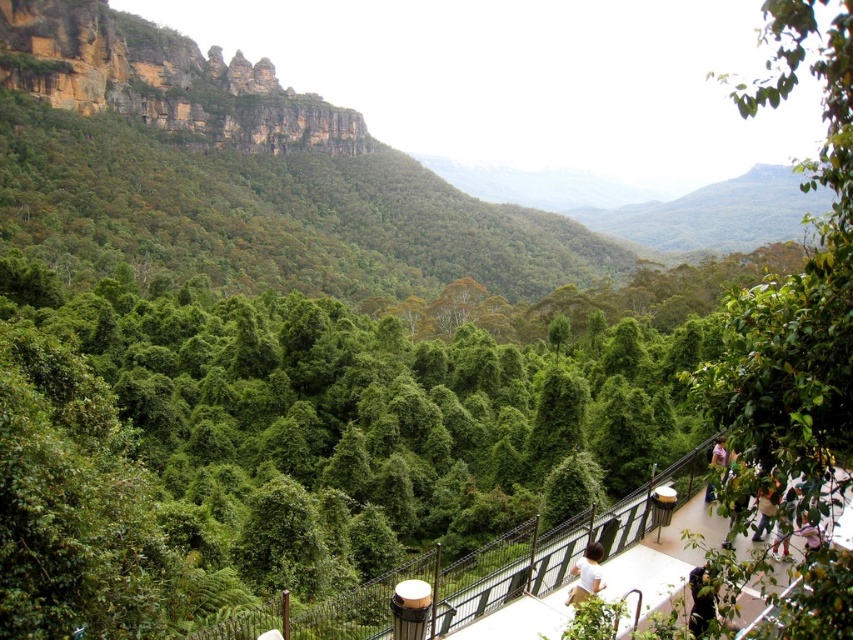
Question: Is dark brown hair at lower right behind white matte person at lower right?

Choices:
 (A) no
 (B) yes

Answer: (B)

Question: Is green leafy forest at upper left positioned before white cotton shirt at lower center?

Choices:
 (A) yes
 (B) no

Answer: (B)

Question: Which point is closer to the camera taking this photo?

Choices:
 (A) (567, 596)
 (B) (224, 248)
 (C) (701, 582)

Answer: (C)

Question: Which object is the farthest from the dark brown hair at lower right?

Choices:
 (A) green leafy tree at right
 (B) green leafy forest at upper left
 (C) white matte person at lower right
 (D) pink fabric person at lower right

Answer: (B)

Question: Which object appears closest to the camera in this image?

Choices:
 (A) green leafy forest at upper left
 (B) pink fabric person at lower right
 (C) dark brown hair at lower right
 (D) white matte person at lower right

Answer: (D)

Question: Can you confirm if green leafy tree at right is thinner than dark brown hair at lower right?

Choices:
 (A) no
 (B) yes

Answer: (A)